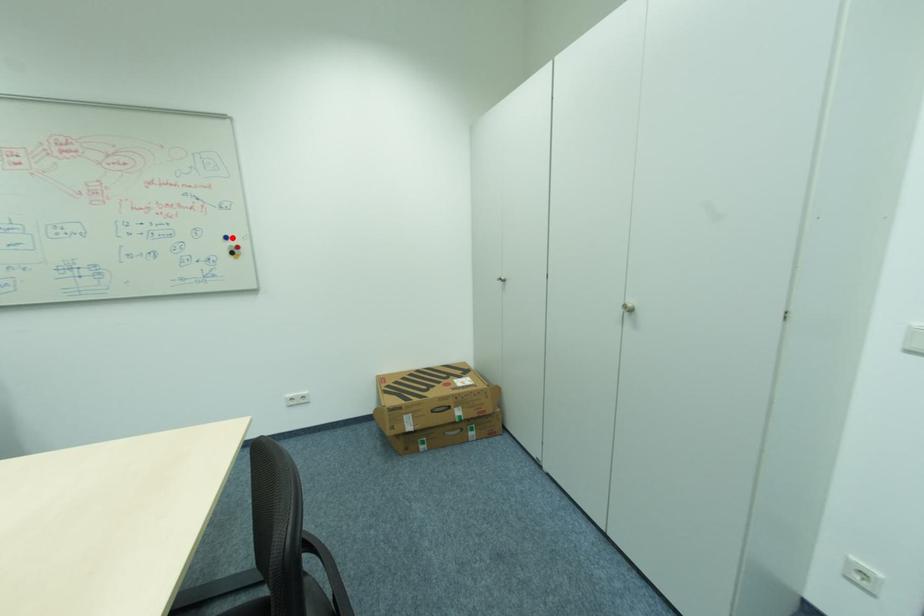
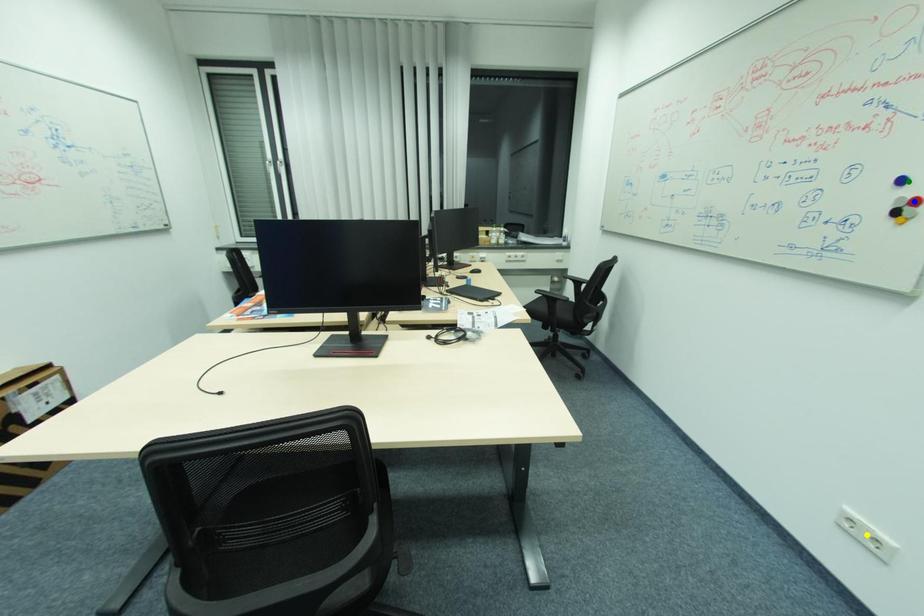
Question: I am providing you with two images of the same scene from different viewpoints. A red point is marked on the first image. You are given multiple points on the second image. Which point in image 2 is actually the same real-world point as the red point in image 1?

Choices:
 (A) yellow point
 (B) blue point
 (C) green point

Answer: (C)